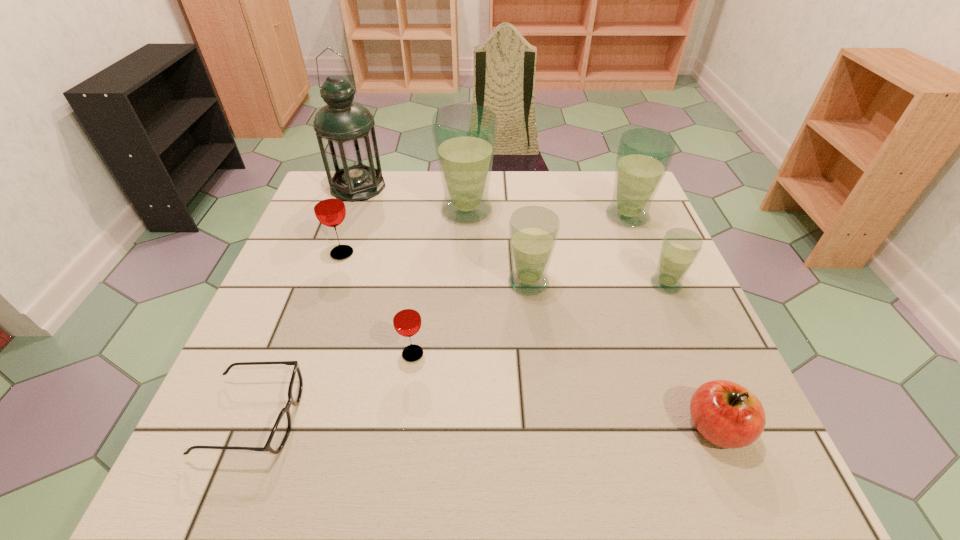
You are a GUI agent. You are given a task and a screenshot of the screen. Output one action in this format:
    pyautogui.click(x=<x>, y=<y>)
    Task: Click on the oil lamp
    The height and width of the screenshot is (540, 960).
    Given the screenshot: What is the action you would take?
    pyautogui.click(x=345, y=132)

The width and height of the screenshot is (960, 540). What are the coordinates of `the tallest object` in the screenshot? It's located at (345, 132).

What are the coordinates of `the eighth shortest object` in the screenshot? It's located at (464, 135).

You are a GUI agent. You are given a task and a screenshot of the screen. Output one action in this format:
    pyautogui.click(x=<x>, y=<y>)
    Task: Click on the leftmost blue glass
    
    Given the screenshot: What is the action you would take?
    pyautogui.click(x=464, y=135)

Identify the location of the third smallest blue glass. (643, 156).

You are a GUI agent. You are given a task and a screenshot of the screen. Output one action in this format:
    pyautogui.click(x=<x>, y=<y>)
    Task: Click on the second tallest glass
    Image resolution: width=960 pixels, height=540 pixels.
    Given the screenshot: What is the action you would take?
    [x=643, y=156]

Locate an element on the screen. This screenshot has width=960, height=540. the left red glass is located at coordinates (329, 208).

I want to click on the bigger red glass, so [329, 208].

The width and height of the screenshot is (960, 540). I want to click on the fourth object from right to left, so pyautogui.click(x=533, y=230).

Where is `the second smallest blue glass`? This screenshot has height=540, width=960. the second smallest blue glass is located at coordinates (533, 230).